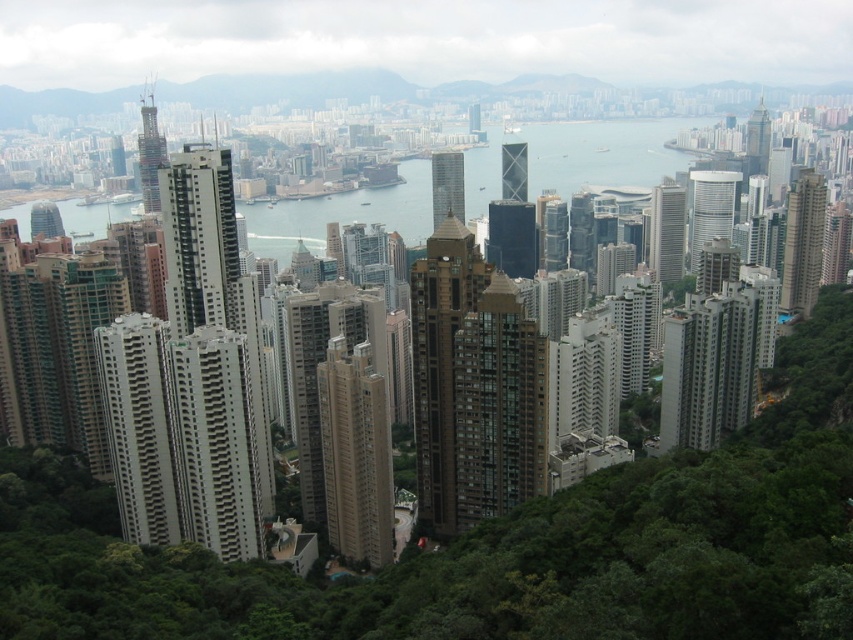
Question: Which point appears farthest from the camera in this image?

Choices:
 (A) (521, 180)
 (B) (700, 198)

Answer: (B)

Question: Considering the relative positions of beige concrete building at center and matte glass skyscraper at center in the image provided, where is beige concrete building at center located with respect to matte glass skyscraper at center?

Choices:
 (A) above
 (B) below

Answer: (B)

Question: Is matte gray skyscraper at center-right smaller than matte glass skyscraper at center?

Choices:
 (A) yes
 (B) no

Answer: (A)

Question: Observing the image, what is the correct spatial positioning of brown glassy building at center in reference to matte glass skyscraper at left?

Choices:
 (A) below
 (B) above

Answer: (A)

Question: Which point is farther to the camera?

Choices:
 (A) (786, 275)
 (B) (459, 314)

Answer: (A)

Question: Which object is farther from the camera taking this photo?

Choices:
 (A) smooth beige skyscraper at right
 (B) matte glass skyscraper at left
 (C) beige concrete building at center

Answer: (A)